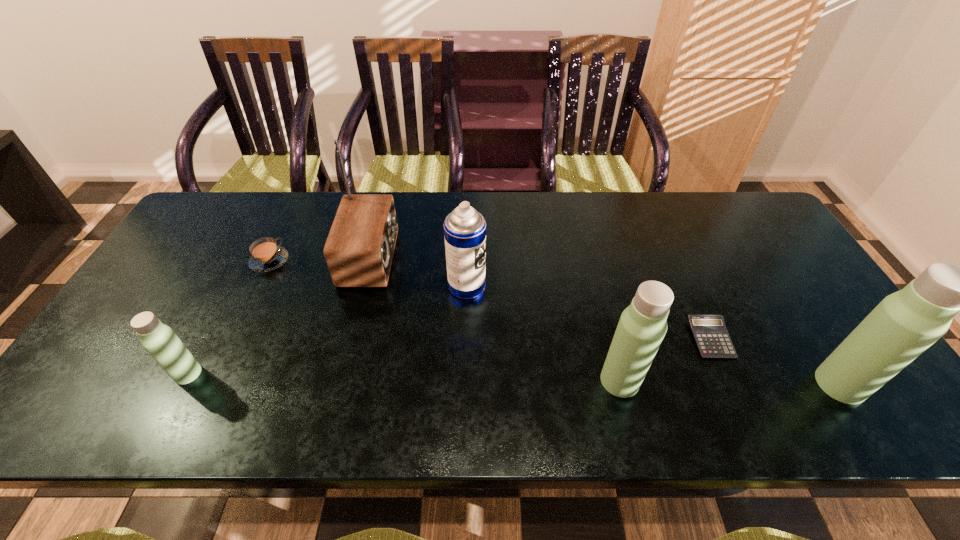
You are a GUI agent. You are given a task and a screenshot of the screen. Output one action in this format:
    pyautogui.click(x=<x>, y=<y>)
    Task: Click on the shortest thermos bottle
    
    Given the screenshot: What is the action you would take?
    [x=159, y=340]

This screenshot has height=540, width=960. In order to click on the leftmost thermos bottle in this screenshot , I will do `click(159, 340)`.

Find the location of a particular element. the second shortest thermos bottle is located at coordinates (642, 326).

Where is `the second thermos bottle from right to left`? the second thermos bottle from right to left is located at coordinates (642, 326).

Locate an element on the screen. the rightmost object is located at coordinates (904, 324).

You are a GUI agent. You are given a task and a screenshot of the screen. Output one action in this format:
    pyautogui.click(x=<x>, y=<y>)
    Task: Click on the radio receiver
    
    Given the screenshot: What is the action you would take?
    pyautogui.click(x=359, y=249)

This screenshot has height=540, width=960. In order to click on the sixth tallest object in this screenshot , I will do `click(266, 255)`.

The height and width of the screenshot is (540, 960). Find the location of `the fourth object from right to left`. the fourth object from right to left is located at coordinates (464, 228).

What are the coordinates of `the shortest object` in the screenshot? It's located at (710, 333).

The width and height of the screenshot is (960, 540). I want to click on the fourth nearest object, so click(710, 333).